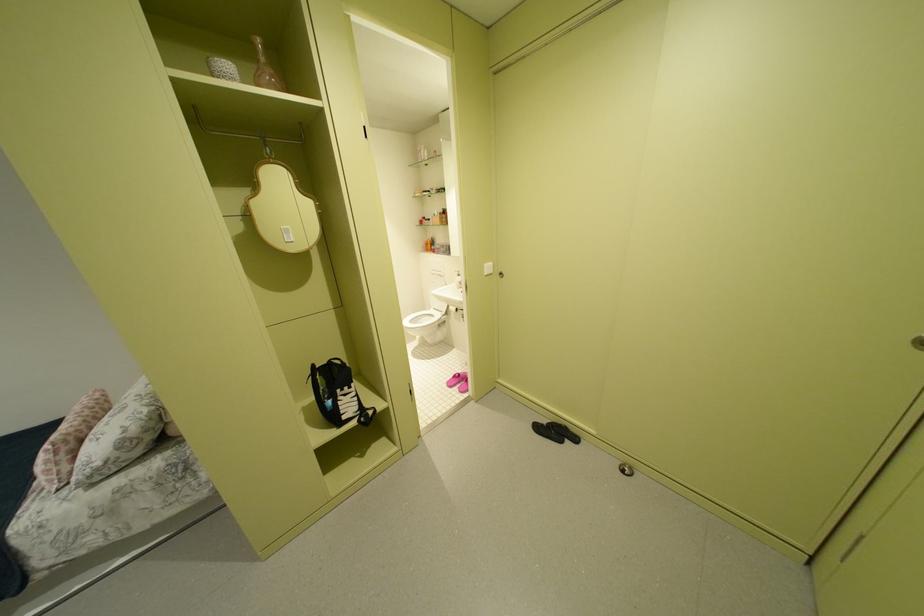
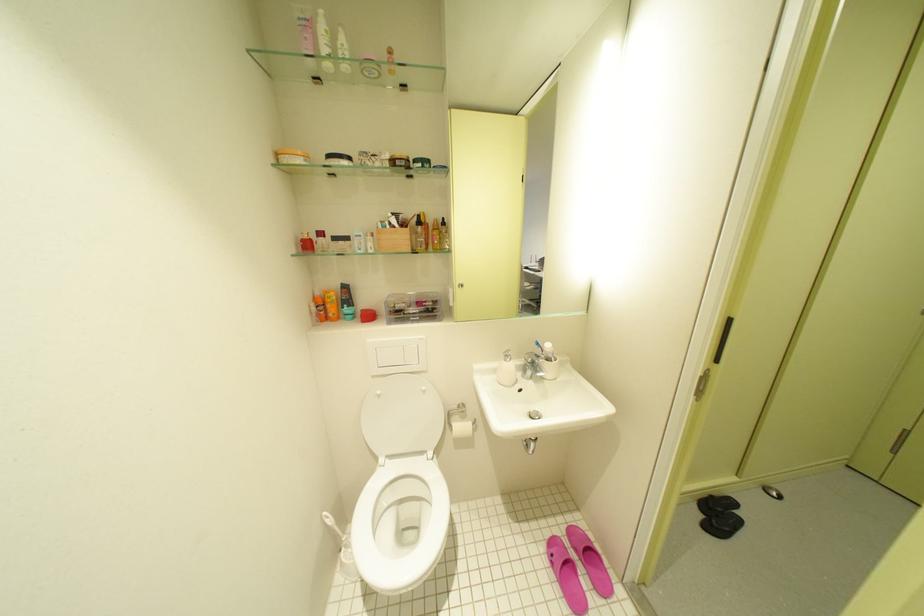
Find the pixel in the second image that matches (459,386) in the first image.

(587, 604)